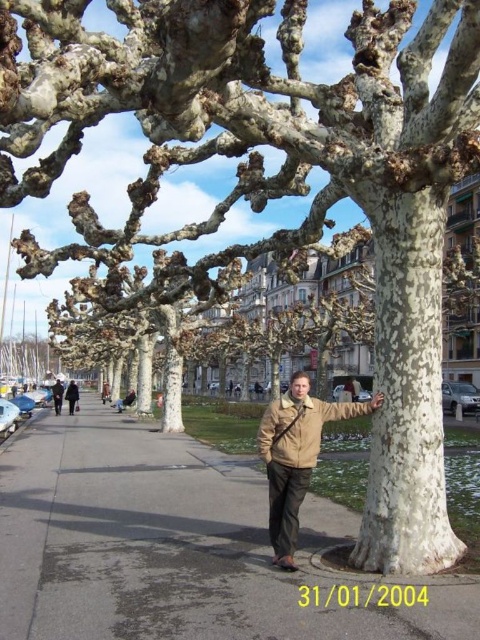
Does gray asphalt sidewalk at center have a larger size compared to light brown leather jacket at center?

Indeed, gray asphalt sidewalk at center has a larger size compared to light brown leather jacket at center.

Can you confirm if gray asphalt sidewalk at center is thinner than light brown leather jacket at center?

No, gray asphalt sidewalk at center is not thinner than light brown leather jacket at center.

Is point (73, 557) less distant than point (74, 401)?

Yes, point (73, 557) is closer to viewer.

The image size is (480, 640). I want to click on gray asphalt sidewalk at center, so click(177, 545).

Is white textured tree trunk at center bigger than khaki cotton jacket at center?

No, white textured tree trunk at center is not bigger than khaki cotton jacket at center.

Between white textured tree trunk at center and khaki cotton jacket at center, which one has more height?

With more height is white textured tree trunk at center.

Who is more forward, (384, 227) or (52, 390)?

Point (384, 227) is more forward.

Where is `white textured tree trunk at center`? Image resolution: width=480 pixels, height=640 pixels. white textured tree trunk at center is located at coordinates (407, 388).

How distant is gray asphalt sidewalk at center from beige leather jacket at center?

The distance of gray asphalt sidewalk at center from beige leather jacket at center is 21.30 meters.

Which is behind, point (67, 554) or point (304, 403)?

The point (304, 403) is behind.

Is point (36, 477) farther from camera compared to point (320, 404)?

Yes, point (36, 477) is farther from viewer.

Where is `gray asphalt sidewalk at center`? gray asphalt sidewalk at center is located at coordinates (177, 545).